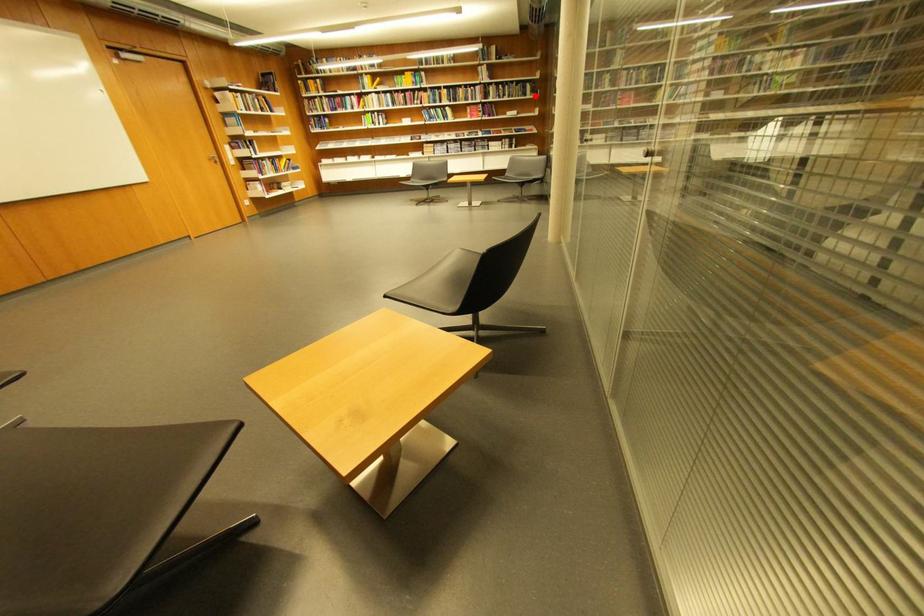
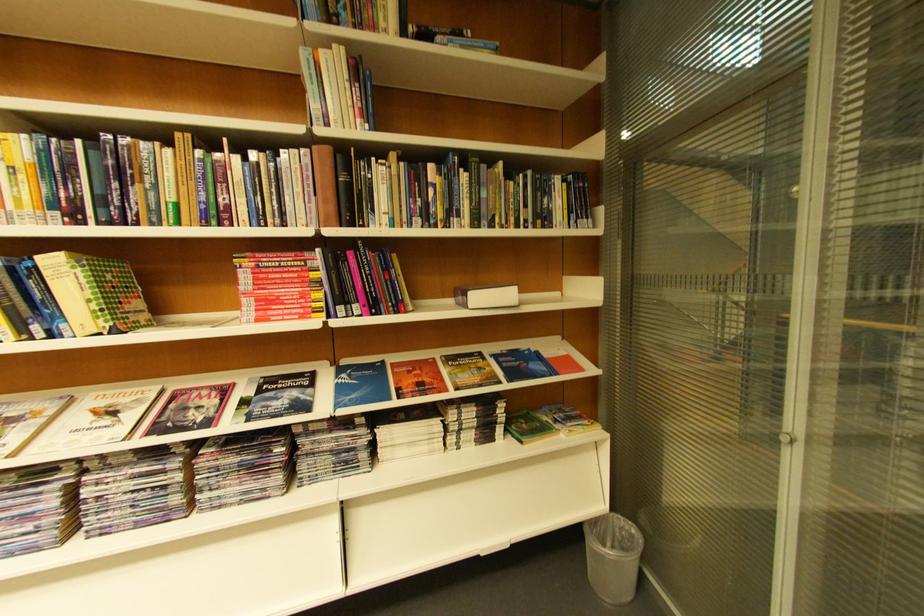
Where in the second image is the point corresponding to the highlighted location from the first image?

(554, 221)